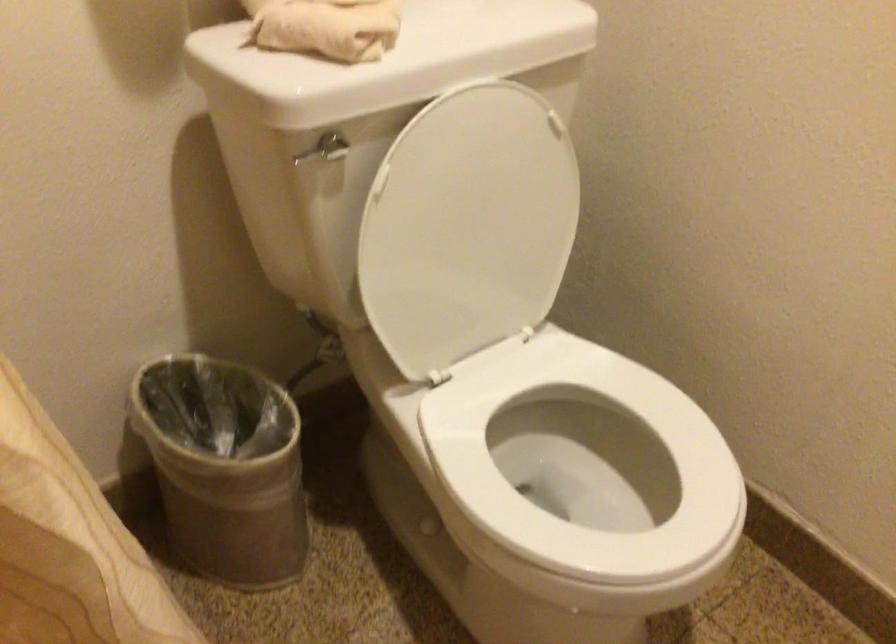
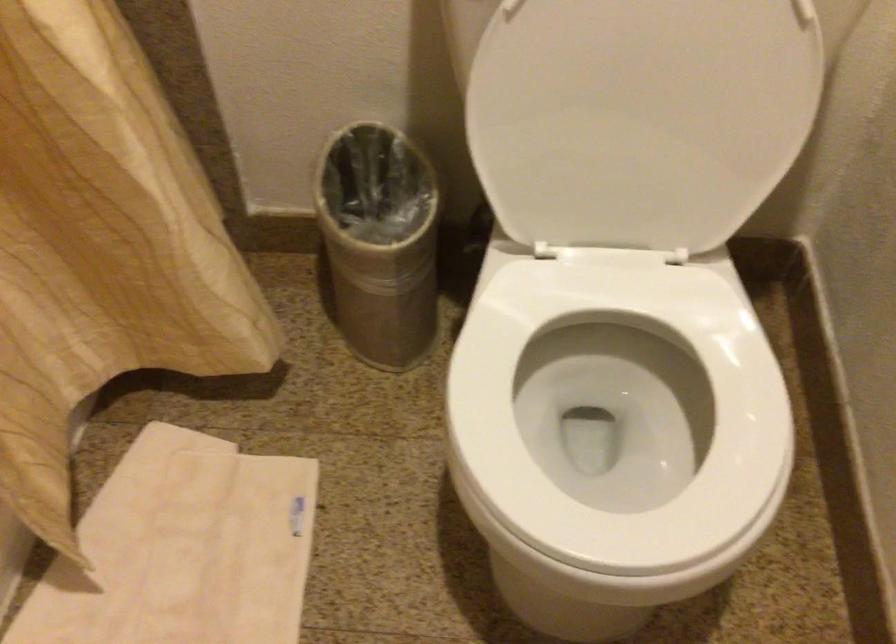
Based on the continuous images, in which direction is the camera rotating?

The rotation direction of the camera is left-down.